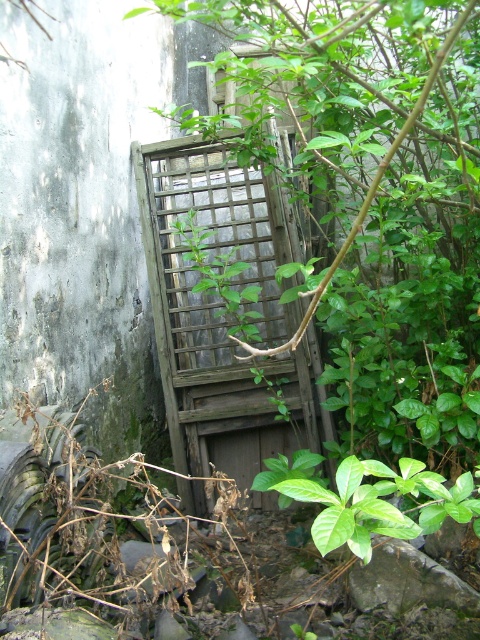
Question: Among these objects, which one is farthest from the camera?

Choices:
 (A) weathered wood trellis at center
 (B) green leafy plant at center

Answer: (A)

Question: Can you confirm if weathered wood trellis at center is positioned to the right of green leafy plant at center?

Choices:
 (A) no
 (B) yes

Answer: (A)

Question: Which point is farther to the camera?

Choices:
 (A) (186, 266)
 (B) (355, 486)

Answer: (A)

Question: Is weathered wood trellis at center smaller than green leafy plant at center?

Choices:
 (A) yes
 (B) no

Answer: (B)

Question: Which of the following is the closest to the observer?

Choices:
 (A) pos(326,502)
 (B) pos(253,225)

Answer: (A)

Question: Is weathered wood trellis at center smaller than green leafy plant at center?

Choices:
 (A) no
 (B) yes

Answer: (A)